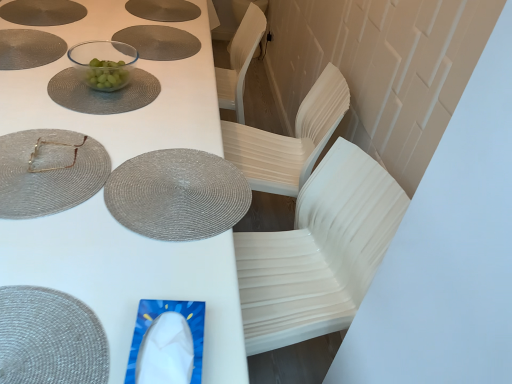
I want to click on empty space that is in between matte silver placemat at upper left, the 1th platter in the left-to-right sequence, and matte gray placemat at upper left, the second plate positioned from the right, so click(x=45, y=23).